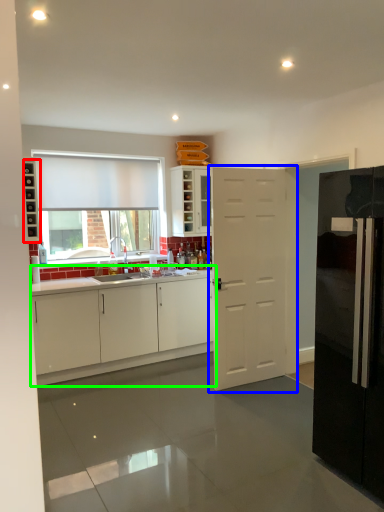
Question: Which is farther away from shelf (highlighted by a red box)? door (highlighted by a blue box) or cabinetry (highlighted by a green box)?

Choices:
 (A) door
 (B) cabinetry

Answer: (B)